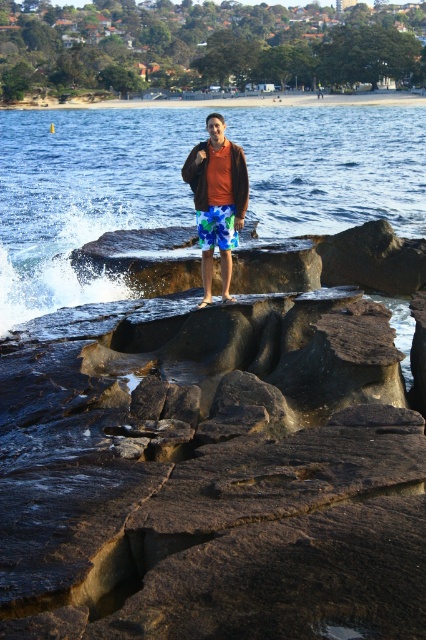
You are a photographer trying to capture the scene. You want to ensure the clear blue water at center and the matte brown jacket at center are both visible in your shot. Given their sizes, which object will occupy more of the frame?

The clear blue water at center is larger in size than the matte brown jacket at center, so it will occupy more of the frame.

You are a photographer trying to capture a closeup of the brown rock at center and the matte brown jacket at center. Which object should you zoom in on first if you want to focus on the larger one?

The brown rock at center is bigger than the matte brown jacket at center, so you should zoom in on the brown rock at center first.